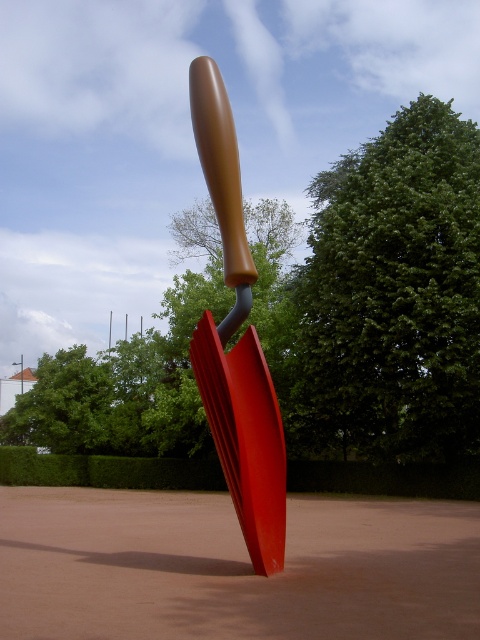
Can you confirm if green leafy tree at upper center is positioned below matte brown handle at center?

Incorrect, green leafy tree at upper center is not positioned below matte brown handle at center.

Does green leafy tree at upper center have a greater width compared to matte brown handle at center?

Yes, green leafy tree at upper center is wider than matte brown handle at center.

Between point (356, 403) and point (255, 419), which one is positioned in front?

Point (255, 419) is more forward.

In order to click on green leafy tree at upper center in this screenshot , I will do `click(393, 294)`.